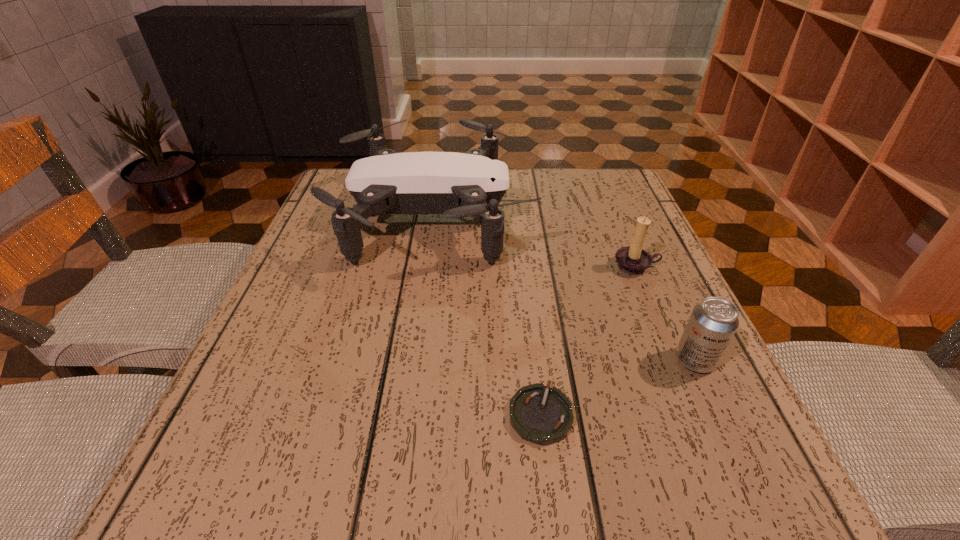
Image resolution: width=960 pixels, height=540 pixels. I want to click on object situated at the left edge, so click(456, 185).

The height and width of the screenshot is (540, 960). What are the coordinates of `candle holder located at the right edge` in the screenshot? It's located at (633, 260).

Where is `beer can that is at the right edge`? beer can that is at the right edge is located at coordinates (713, 322).

This screenshot has width=960, height=540. In order to click on object at the far left corner in this screenshot , I will do `click(456, 185)`.

At what (x,y) coordinates should I click in order to perform the action: click on vacant area at the left edge of the desktop. Please return your answer as a coordinate pair (x, y). The height and width of the screenshot is (540, 960). Looking at the image, I should click on (329, 293).

You are a GUI agent. You are given a task and a screenshot of the screen. Output one action in this format:
    pyautogui.click(x=<x>, y=<y>)
    Task: Click on the free space at the right edge of the desktop
    
    Given the screenshot: What is the action you would take?
    pyautogui.click(x=596, y=257)

The height and width of the screenshot is (540, 960). In order to click on vacant area at the far left corner in this screenshot , I will do (x=327, y=190).

The image size is (960, 540). What are the coordinates of `vacant space at the far right corner of the desktop` in the screenshot? It's located at (639, 202).

In order to click on vacant space at the near right corner of the desktop in this screenshot , I will do `click(724, 510)`.

The height and width of the screenshot is (540, 960). I want to click on empty location between the candle holder and the tallest object, so click(536, 242).